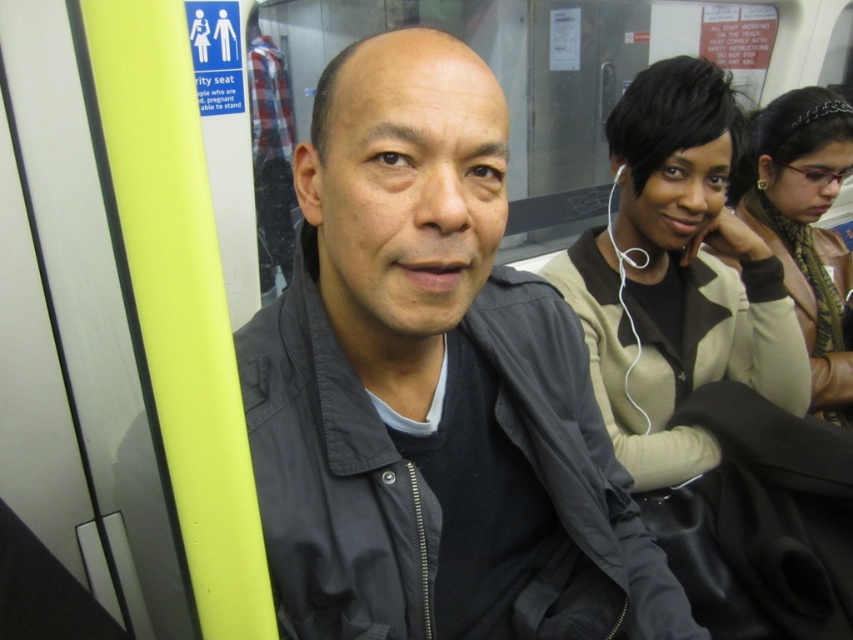
Question: Which of the following is the farthest from the observer?

Choices:
 (A) (381, 621)
 (B) (830, 150)
 (C) (595, 253)

Answer: (B)

Question: Does dark gray jacket at center come behind brown textured scarf at upper right?

Choices:
 (A) yes
 (B) no

Answer: (B)

Question: Estimate the real-world distances between objects in this image. Which object is farther from the dark gray jacket at center?

Choices:
 (A) beige fabric jacket at center
 (B) brown textured scarf at upper right

Answer: (B)

Question: Which of the following is the farthest from the observer?

Choices:
 (A) (744, 141)
 (B) (664, 634)
 (C) (770, 272)

Answer: (A)

Question: Where is dark gray jacket at center located in relation to beige fabric jacket at center in the image?

Choices:
 (A) above
 (B) below

Answer: (B)

Question: Can you confirm if dark gray jacket at center is bigger than brown textured scarf at upper right?

Choices:
 (A) yes
 (B) no

Answer: (B)